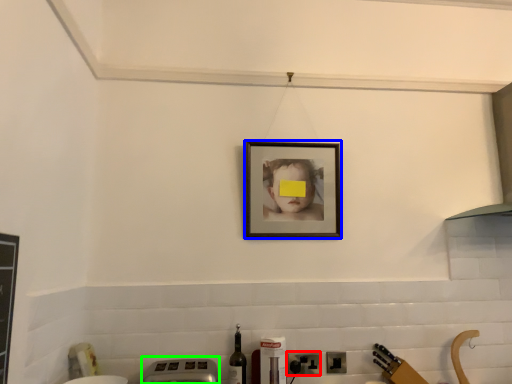
Question: Which is farther away from electric outlet (highlighted by a red box)? picture frame (highlighted by a blue box) or appliance (highlighted by a green box)?

Choices:
 (A) picture frame
 (B) appliance

Answer: (A)